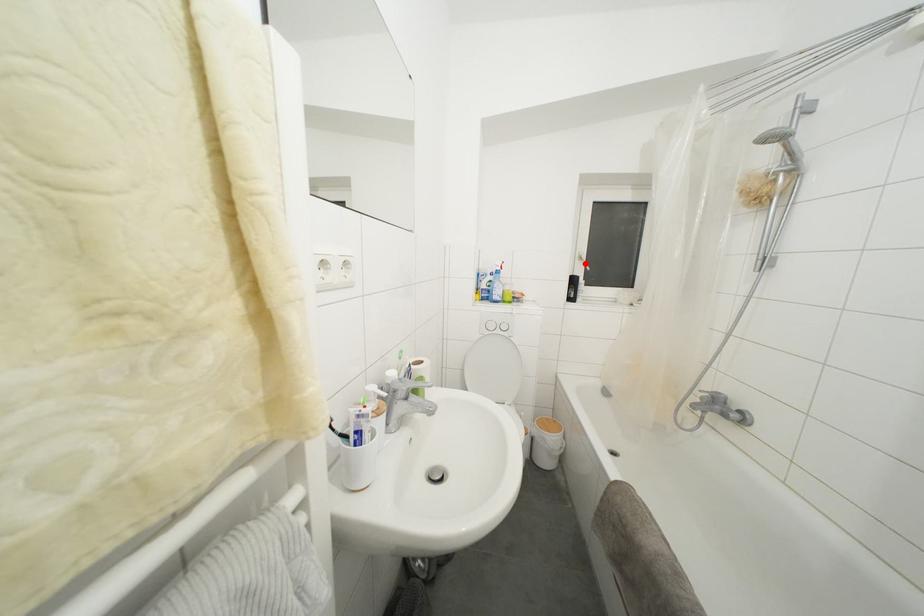
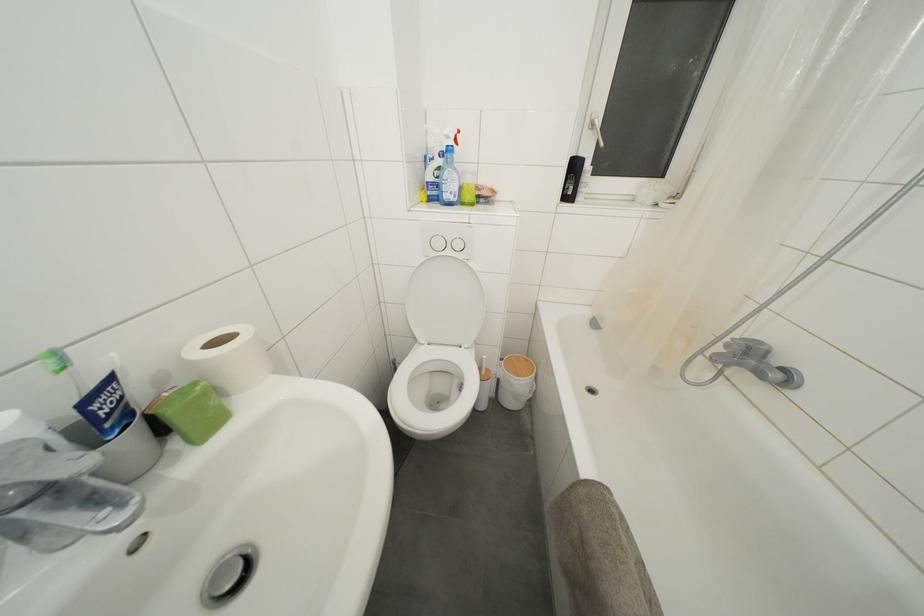
The point at the highlighted location is marked in the first image. Where is the corresponding point in the second image?

(597, 131)